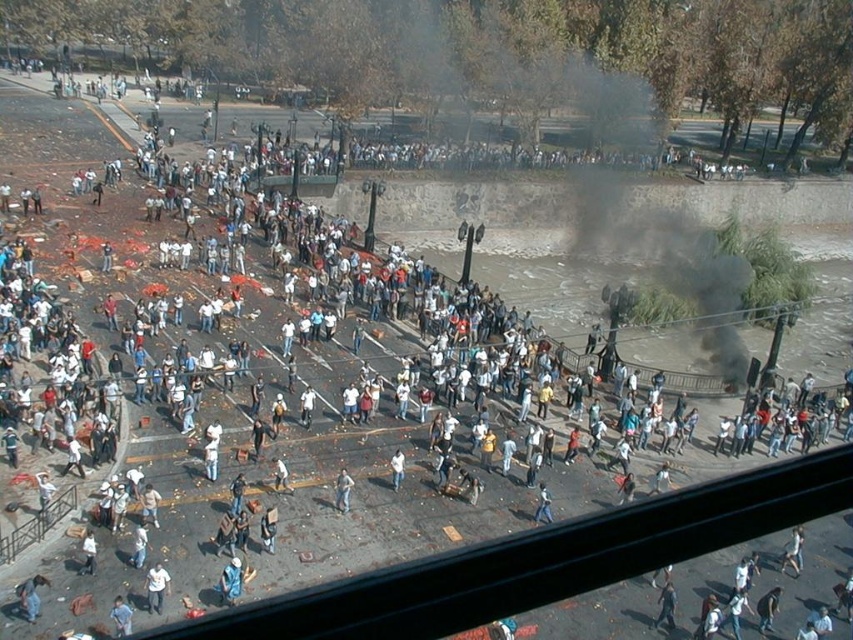
You are a photographer trying to capture a clear shot of both the white cotton shirt at lower center and the white matte shirt at center. Given their sizes, which shirt would you need to zoom in more on to ensure it fills the frame appropriately?

Since the white cotton shirt at lower center is larger in width than the white matte shirt at center, you would need to zoom in more on the white matte shirt at center to ensure it fills the frame appropriately.

You are a photographer trying to capture a clear shot of the white cotton shirt at lower center and the white matte shirt at center. Since the scene is crowded, you need to adjust your camera angle. Given their positions, which shirt should you focus on first to ensure both are in frame?

The white cotton shirt at lower center is below the white matte shirt at center, so you should focus on the white matte shirt at center first to ensure both are visible in the frame.

You are a photographer trying to capture a clear shot of the white matte shirt at center without the blue denim jeans at lower center blocking it. What adjustment should you make to your camera position?

Move your camera position backward so that the blue denim jeans at lower center is no longer in front of the white matte shirt at center.